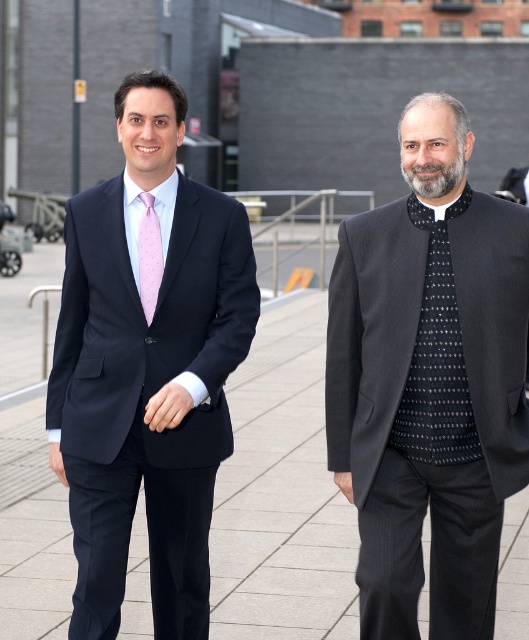
You are a fashion designer observing two items in the scene. You need to determine which item is taller between the matte black suit at left and the matte pink silk tie at left. Based on the description, which one is taller?

The matte black suit at left is taller than the matte pink silk tie at left according to the description.

You are a photographer positioned at the camera location. You want to capture a photo of the two people standing on the walkway. The focus point of your camera is set to point [12,529]. Will the two individuals be in focus if the depth of field can cover 8 meters?

The distance between point [12,529] and the camera is 8.20 meters. Since the depth of field can cover 8 meters, which is slightly less than the required distance, the two individuals might not be fully in focus. Adjust the camera settings or move closer to ensure they are sharp.